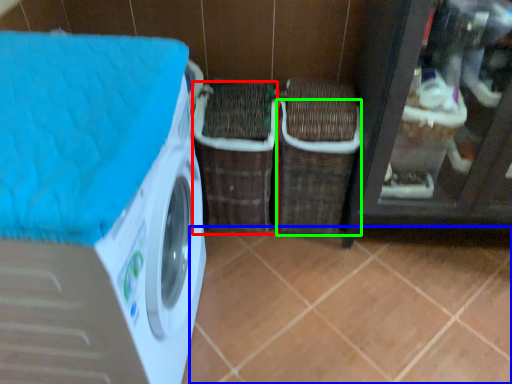
Question: Which object is the closest to the basket (highlighted by a red box)? Choose among these: tile (highlighted by a blue box) or basket (highlighted by a green box).

Choices:
 (A) tile
 (B) basket

Answer: (B)